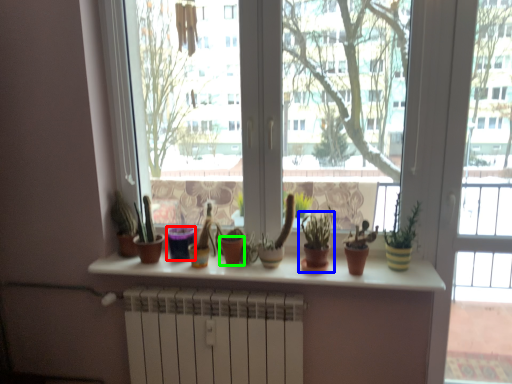
Question: Which object is positioned closest to flowerpot (highlighted by a red box)? Select from houseplant (highlighted by a blue box) and flowerpot (highlighted by a green box).

Choices:
 (A) houseplant
 (B) flowerpot

Answer: (B)